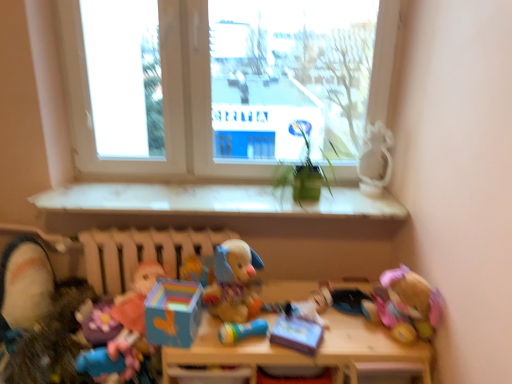
Question: From the image's perspective, is transparent glass window at center, acting as the first window screen starting from the right, on matte pink plush at lower left, which is counted as the ninth toy, starting from the right?

Choices:
 (A) yes
 (B) no

Answer: (A)

Question: Can you confirm if transparent glass window at center, positioned as the second window screen in left-to-right order, is wider than matte pink plush at lower left, which is counted as the ninth toy, starting from the right?

Choices:
 (A) no
 (B) yes

Answer: (A)

Question: From a real-world perspective, is transparent glass window at center, positioned as the second window screen in left-to-right order, on top of matte pink plush at lower left, which is counted as the 2th toy, starting from the left?

Choices:
 (A) no
 (B) yes

Answer: (B)

Question: From a real-world perspective, is transparent glass window at center, positioned as the second window screen in left-to-right order, below matte pink plush at lower left, which is counted as the ninth toy, starting from the right?

Choices:
 (A) no
 (B) yes

Answer: (A)

Question: Is transparent glass window at center, acting as the first window screen starting from the right, outside matte pink plush at lower left, which is counted as the ninth toy, starting from the right?

Choices:
 (A) yes
 (B) no

Answer: (A)

Question: Is transparent glass window at center, acting as the first window screen starting from the right, touching matte pink plush at lower left, which is counted as the 2th toy, starting from the left?

Choices:
 (A) yes
 (B) no

Answer: (B)

Question: Is matte cardboard box at center, the 4th toy from the left, beside white glossy window sill at center?

Choices:
 (A) no
 (B) yes

Answer: (A)

Question: Considering the relative sizes of matte cardboard box at center, the 4th toy from the left, and white glossy window sill at center in the image provided, is matte cardboard box at center, the 4th toy from the left, wider than white glossy window sill at center?

Choices:
 (A) no
 (B) yes

Answer: (A)

Question: Does matte cardboard box at center, the 7th toy from the right, have a greater height compared to white glossy window sill at center?

Choices:
 (A) no
 (B) yes

Answer: (B)

Question: Is matte cardboard box at center, the 7th toy from the right, located outside white glossy window sill at center?

Choices:
 (A) yes
 (B) no

Answer: (A)

Question: From the image's perspective, is matte cardboard box at center, the 4th toy from the left, located beneath white glossy window sill at center?

Choices:
 (A) yes
 (B) no

Answer: (A)

Question: Is there a large distance between matte cardboard box at center, the 4th toy from the left, and white glossy window sill at center?

Choices:
 (A) no
 (B) yes

Answer: (A)

Question: Can you confirm if white matte radiator at center is shorter than soft plush toy at lower left, the tenth toy positioned from the right?

Choices:
 (A) yes
 (B) no

Answer: (B)